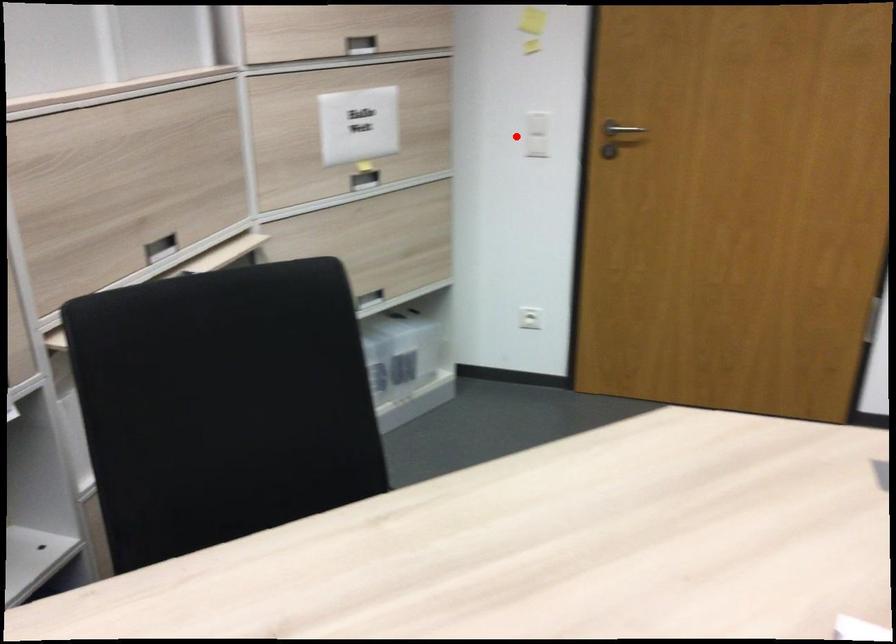
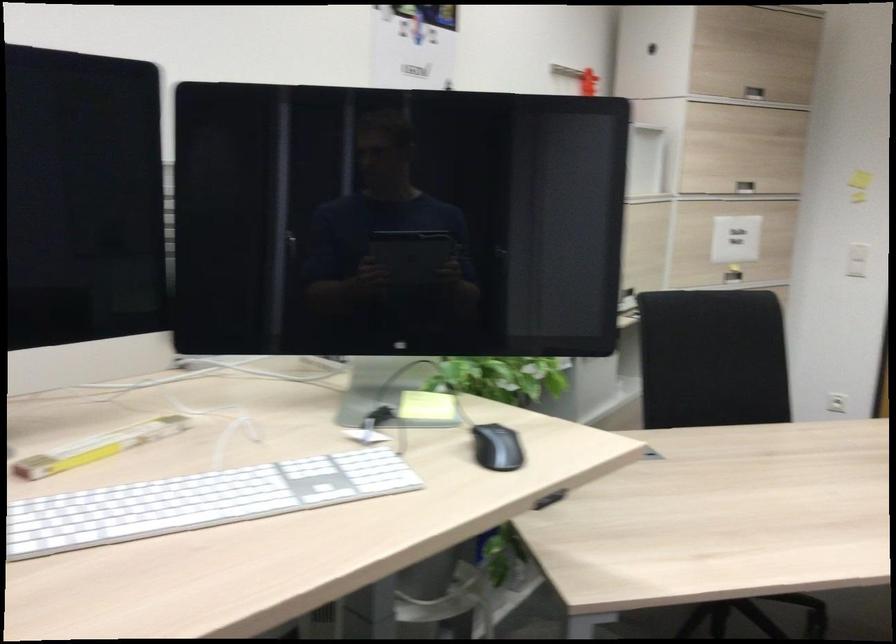
In the second image, find the point that corresponds to the highlighted location in the first image.

(857, 260)